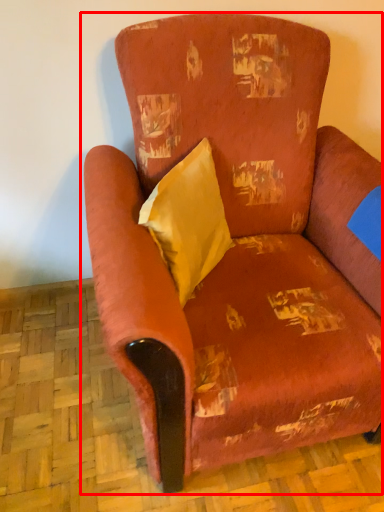
Question: From the image's perspective, where is chair (annotated by the red box) located relative to throw pillow?

Choices:
 (A) above
 (B) below

Answer: (B)